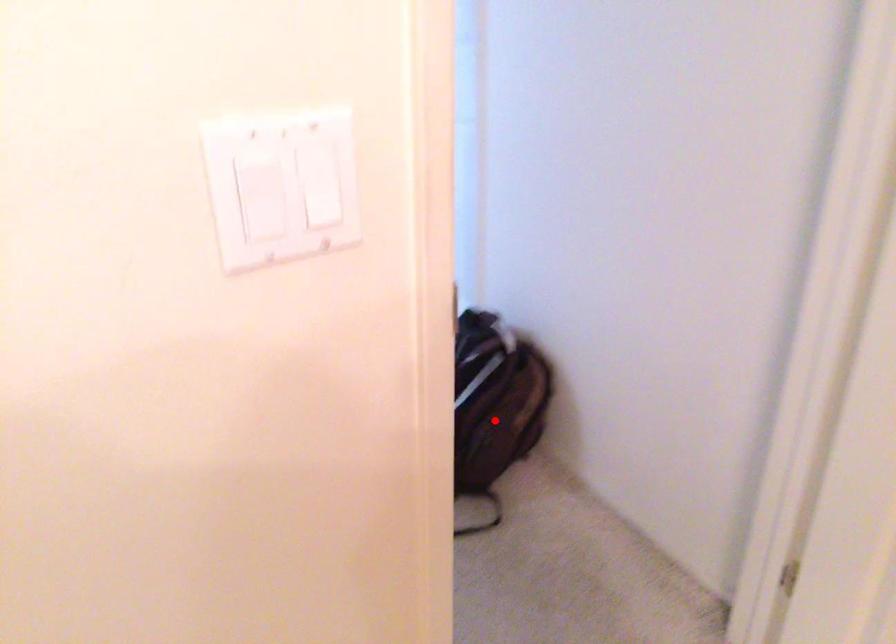
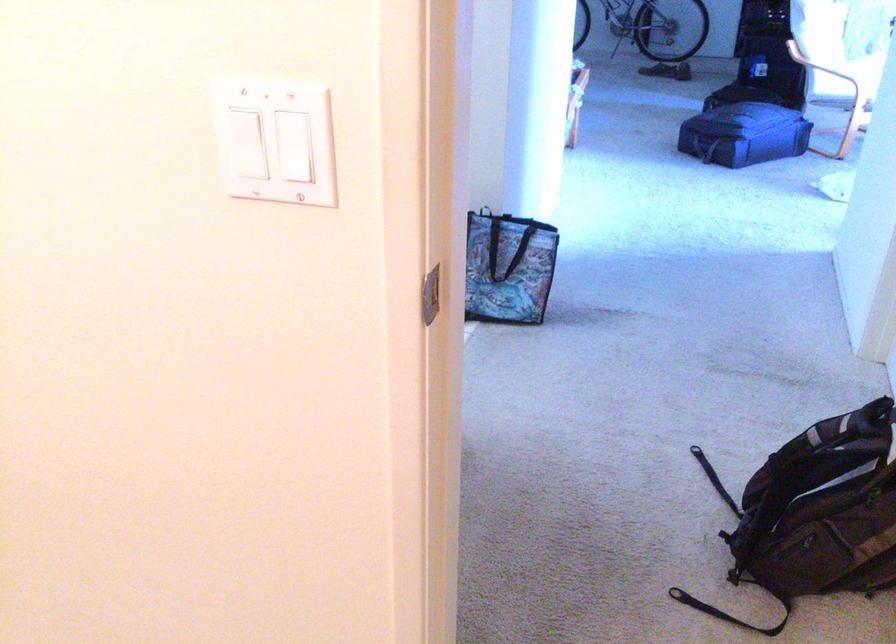
Locate, in the second image, the point that corresponds to the highlighted location in the first image.

(826, 516)